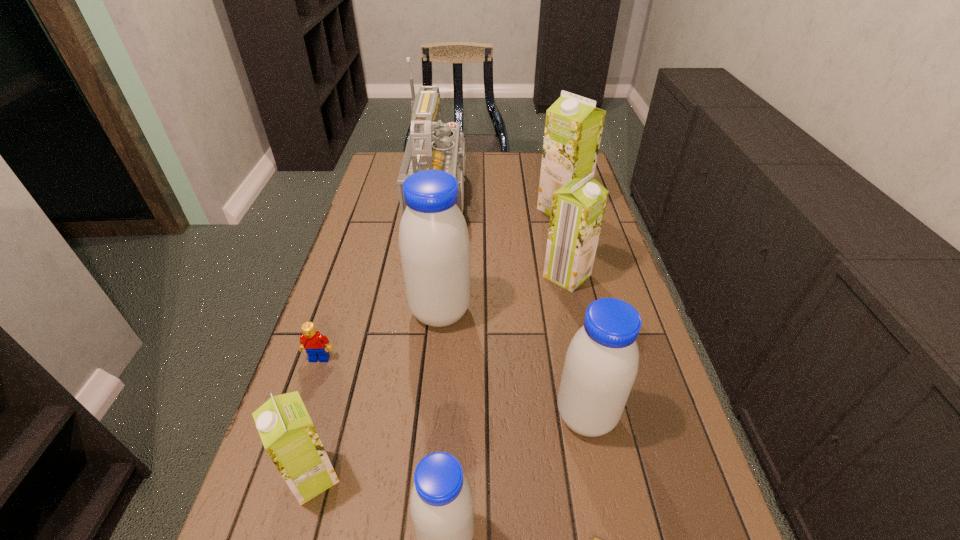
The image size is (960, 540). Find the location of `soya milk that is positioned at the left edge`. soya milk that is positioned at the left edge is located at coordinates (289, 437).

The height and width of the screenshot is (540, 960). What are the coordinates of `Lego present at the left edge` in the screenshot? It's located at (312, 341).

Find the location of a particular element. The image size is (960, 540). object situated at the far left corner is located at coordinates (431, 145).

In the image, there is a desktop. What are the coordinates of `free space at the left edge` in the screenshot? It's located at (369, 399).

Find the location of `vacant space at the right edge of the desktop`. vacant space at the right edge of the desktop is located at coordinates (682, 450).

Identify the location of vacant area at the far left corner of the desktop. (390, 165).

This screenshot has height=540, width=960. I want to click on unoccupied position between the second farthest blue soya milk and the seventh farthest object, so click(x=449, y=447).

Where is `free space between the rightmost blue soya milk and the gray radio receiver`? Image resolution: width=960 pixels, height=540 pixels. free space between the rightmost blue soya milk and the gray radio receiver is located at coordinates (516, 307).

The width and height of the screenshot is (960, 540). I want to click on empty space that is in between the farthest blue soya milk and the farthest green soya milk, so click(x=501, y=260).

You are a GUI agent. You are given a task and a screenshot of the screen. Output one action in this format:
    pyautogui.click(x=<x>, y=<y>)
    Task: Click on the object that is the eighth closest to the second smallest green soya milk
    
    Given the screenshot: What is the action you would take?
    pyautogui.click(x=289, y=437)